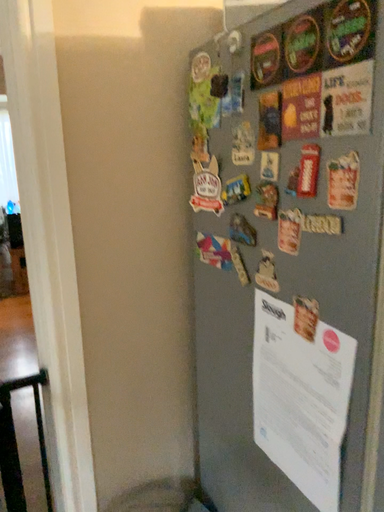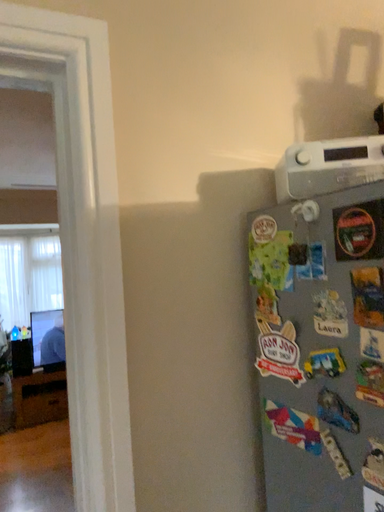
Question: How did the camera likely rotate when shooting the video?

Choices:
 (A) rotated upward
 (B) rotated downward

Answer: (A)